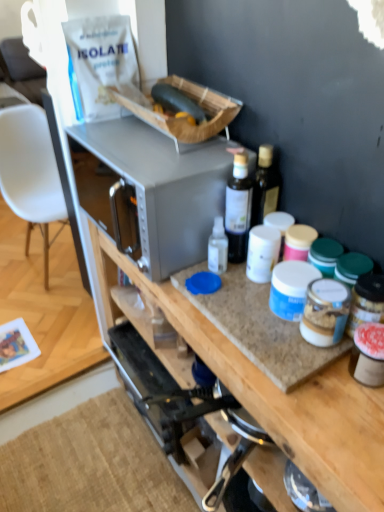
Question: Does granite countertop at center appear on the right side of green matte zucchini at upper center?

Choices:
 (A) no
 (B) yes

Answer: (B)

Question: Considering the relative sizes of granite countertop at center and green matte zucchini at upper center in the image provided, is granite countertop at center smaller than green matte zucchini at upper center?

Choices:
 (A) yes
 (B) no

Answer: (B)

Question: Is granite countertop at center positioned far away from green matte zucchini at upper center?

Choices:
 (A) yes
 (B) no

Answer: (B)

Question: From the image's perspective, does granite countertop at center appear lower than green matte zucchini at upper center?

Choices:
 (A) no
 (B) yes

Answer: (B)

Question: Is green matte zucchini at upper center completely or partially inside granite countertop at center?

Choices:
 (A) no
 (B) yes

Answer: (A)

Question: From the image's perspective, is satin silver microwave at center above or below transparent plastic bottle at center?

Choices:
 (A) above
 (B) below

Answer: (A)

Question: Is satin silver microwave at center spatially inside transparent plastic bottle at center, or outside of it?

Choices:
 (A) outside
 (B) inside

Answer: (A)

Question: Does point (162, 279) appear closer or farther from the camera than point (243, 194)?

Choices:
 (A) farther
 (B) closer

Answer: (A)

Question: In terms of size, does satin silver microwave at center appear bigger or smaller than transparent plastic bottle at center?

Choices:
 (A) small
 (B) big

Answer: (B)

Question: From a real-world perspective, relative to granite countertop at center, is green matte zucchini at upper center vertically above or below?

Choices:
 (A) above
 (B) below

Answer: (A)

Question: From the image's perspective, is green matte zucchini at upper center located above or below granite countertop at center?

Choices:
 (A) above
 (B) below

Answer: (A)

Question: Is point (162, 98) positioned closer to the camera than point (274, 402)?

Choices:
 (A) closer
 (B) farther

Answer: (B)

Question: Choose the correct answer: Is green matte zucchini at upper center inside granite countertop at center or outside it?

Choices:
 (A) inside
 (B) outside

Answer: (B)

Question: From the image's perspective, is transparent plastic bottle at center above or below white plastic chair at left?

Choices:
 (A) below
 (B) above

Answer: (A)

Question: Is transparent plastic bottle at center bigger or smaller than white plastic chair at left?

Choices:
 (A) big
 (B) small

Answer: (B)